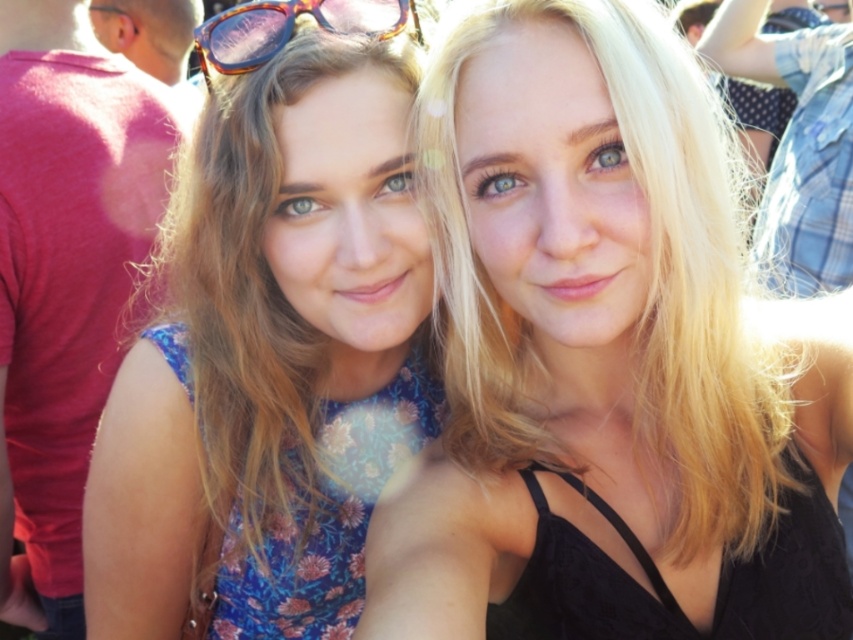
Based on the photo, you are a photographer at a social event. You need to capture a group photo where the blonde hair at center and the floral fabric dress at left are both visible. Considering their sizes, which one should you ensure is closer to the camera to avoid being too small in the frame?

Since the blonde hair at center is larger than the floral fabric dress at left, you should ensure the floral fabric dress at left is closer to the camera to avoid it appearing too small in the frame.

You are a photographer trying to capture a clear shot of the blonde hair at center and the tortoiseshell plastic goggles at upper center. Which object should you focus on to ensure it appears larger in the photo?

The blonde hair at center should be focused on because it is bigger than the tortoiseshell plastic goggles at upper center, so it will naturally appear larger in the photo.